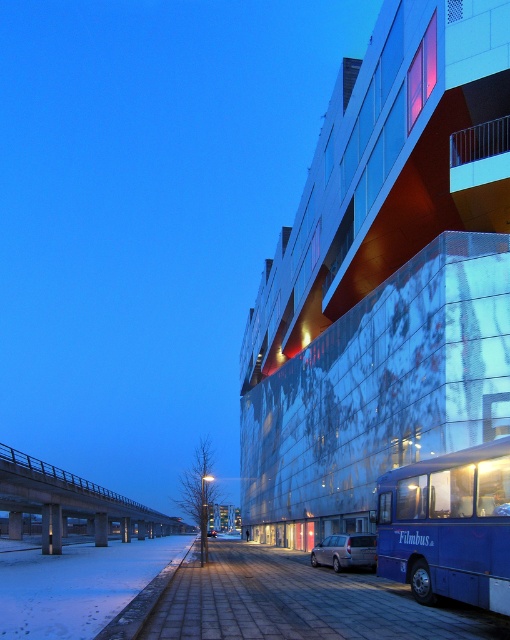
You are standing at the point closer to the silver car parked further down the street and want to walk towards the building on the right. Which point, point (78, 486) or point (349, 564), should you aim for to reach the building?

You should aim for point (78, 486) because it is behind point (349, 564), meaning it is closer to the building on the right.

You are a pedestrian standing on the sidewalk and want to cross the street to reach the modern building on the right. There is a concrete bridge at lower left and a silver metallic van at center in your view. Which object is closer to the modern building on the right?

The silver metallic van at center is closer to the modern building on the right than the concrete bridge at lower left.

You are a pedestrian standing on the sidewalk and want to cross the street. You see the blue metallic bus at lower right and the silver metallic van at center. Which vehicle is closer to the middle of the street?

The silver metallic van at center is closer to the middle of the street because the blue metallic bus at lower right is to the left of it, meaning the van is positioned further towards the center.